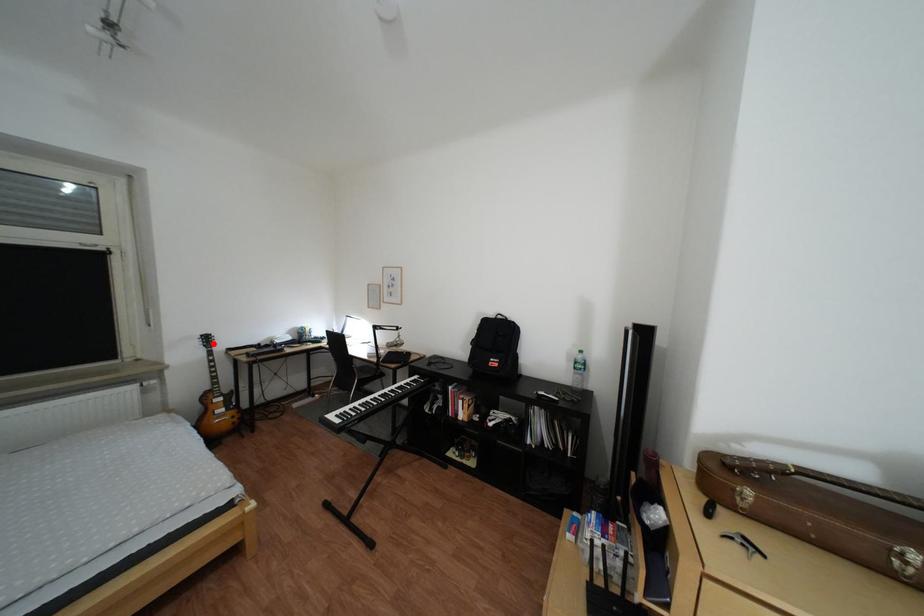
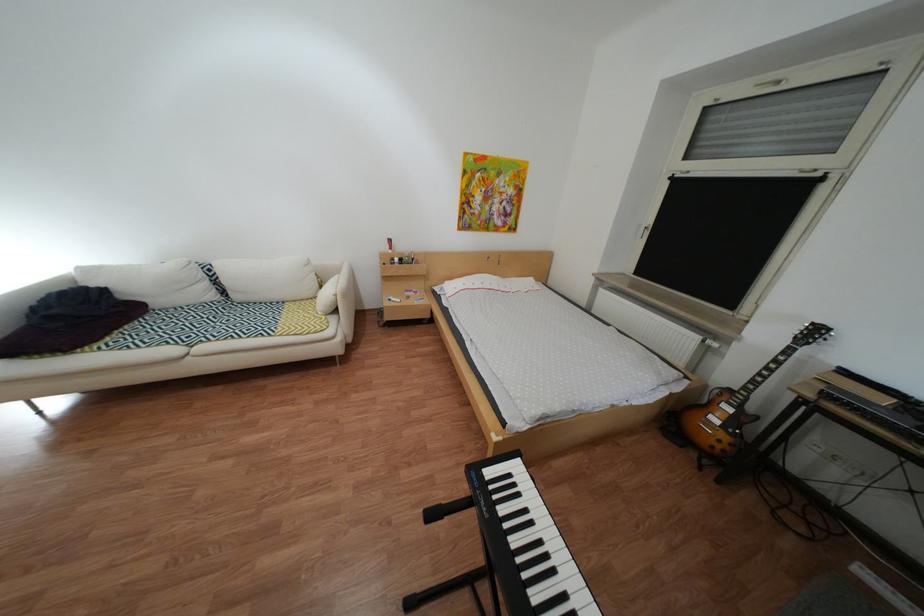
Question: I am providing you with two images of the same scene from different viewpoints. A red point is marked on the first image. Can you still see the location of the red point in image 2?

Choices:
 (A) Yes
 (B) No

Answer: (A)